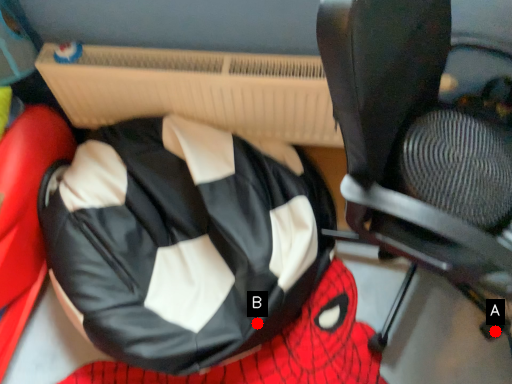
Question: Two points are circled on the image, labeled by A and B beside each circle. Which point is further to the camera?

Choices:
 (A) A is further
 (B) B is further

Answer: (A)